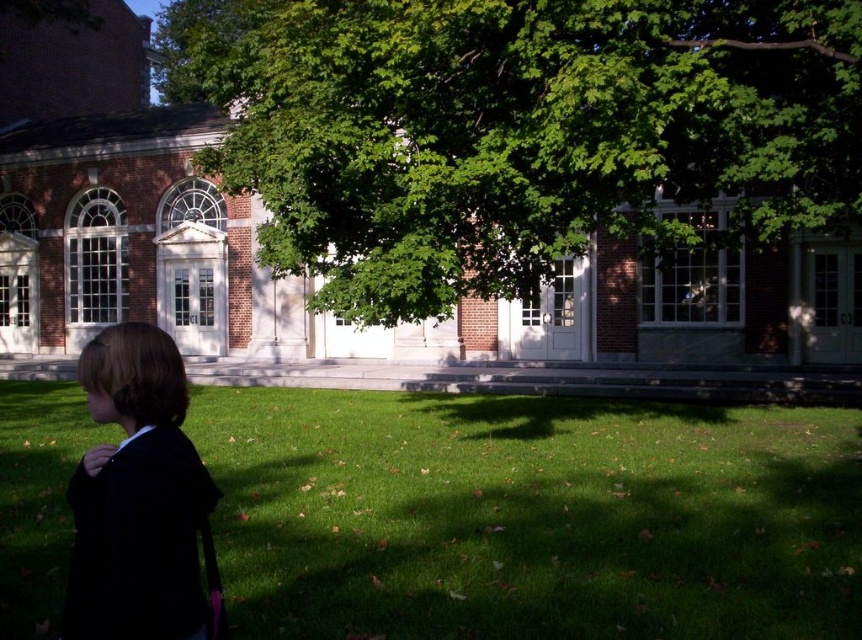
Question: Which point is closer to the camera?

Choices:
 (A) black fabric jacket at lower left
 (B) green grass at lower left
 (C) green leafy tree at center

Answer: (A)

Question: Is green leafy tree at center to the right of black fabric jacket at lower left from the viewer's perspective?

Choices:
 (A) yes
 (B) no

Answer: (B)

Question: Is green grass at lower left positioned behind black fabric jacket at lower left?

Choices:
 (A) no
 (B) yes

Answer: (B)

Question: Which is farther from the black fabric jacket at lower left?

Choices:
 (A) green leafy tree at center
 (B) green grass at lower left

Answer: (A)

Question: Considering the real-world distances, which object is closest to the green leafy tree at center?

Choices:
 (A) black fabric jacket at lower left
 (B) green grass at lower left

Answer: (B)

Question: In this image, where is green leafy tree at center located relative to black fabric jacket at lower left?

Choices:
 (A) left
 (B) right

Answer: (A)